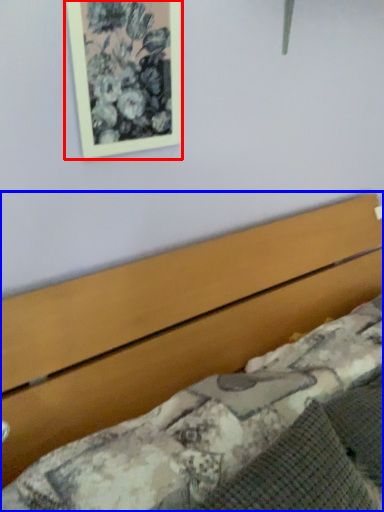
Question: Which object is closer to the camera taking this photo, picture frame (highlighted by a red box) or bed (highlighted by a blue box)?

Choices:
 (A) picture frame
 (B) bed

Answer: (B)